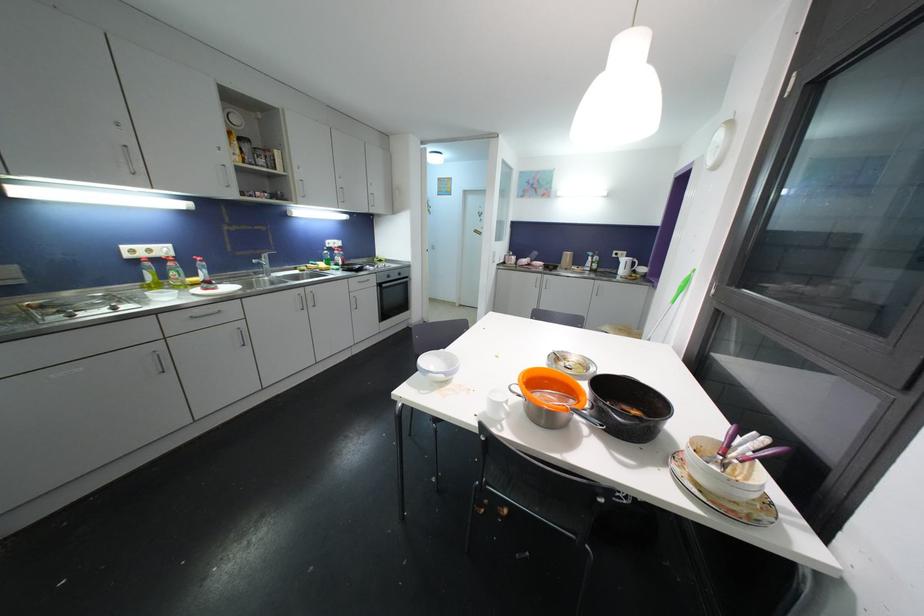
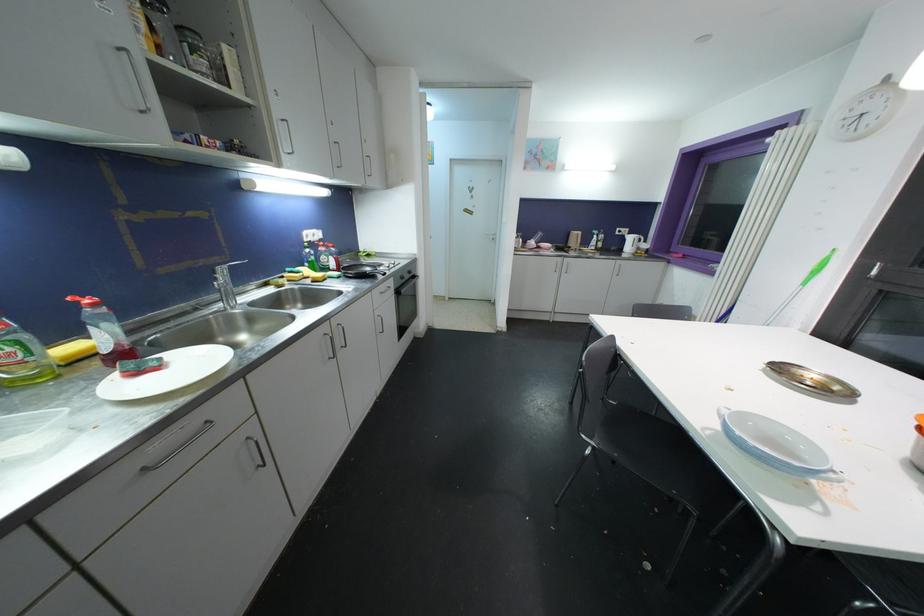
Find the pixel in the second image that matches the point at 403,277 in the first image.

(412, 275)